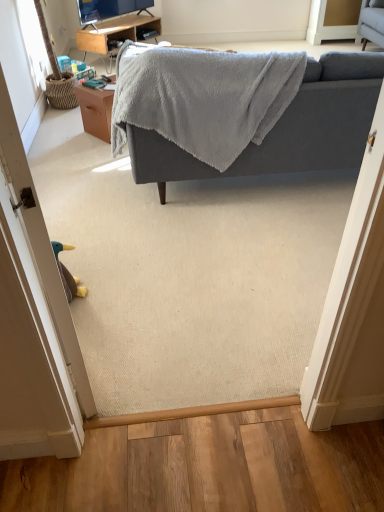
This screenshot has width=384, height=512. What do you see at coordinates (328, 26) in the screenshot? I see `white glossy screen door at upper right` at bounding box center [328, 26].

From the picture: In order to face white glossy screen door at upper right, should I rotate leftwards or rightwards?

Rotate your view right by about 19.522°.

The width and height of the screenshot is (384, 512). Describe the element at coordinates (34, 323) in the screenshot. I see `brown fabric door at lower left` at that location.

At what (x,y) coordinates should I click in order to perform the action: click on brown fabric door at lower left. Please return your answer as a coordinate pair (x, y). Looking at the image, I should click on (34, 323).

Measure the distance between gray soft fabric couch at upper center and camera.

The distance of gray soft fabric couch at upper center from camera is 2.13 meters.

Image resolution: width=384 pixels, height=512 pixels. What do you see at coordinates (96, 111) in the screenshot?
I see `brown wood table at center` at bounding box center [96, 111].

This screenshot has width=384, height=512. In order to click on white glossy screen door at upper right in this screenshot , I will do `click(328, 26)`.

Is woodendesk at upper center behind gray soft fabric couch at upper center?

Yes, it is behind gray soft fabric couch at upper center.

Is woodendesk at upper center with gray soft fabric couch at upper center?

No, woodendesk at upper center is not with gray soft fabric couch at upper center.

Does point (79, 34) appear closer or farther from the camera than point (319, 68)?

Clearly, point (79, 34) is more distant from the camera than point (319, 68).

From the image's perspective, is woodendesk at upper center positioned above or below gray soft fabric couch at upper center?

Clearly, from the image's perspective, woodendesk at upper center is above gray soft fabric couch at upper center.

Considering the positions of objects brown wood table at center and white glossy screen door at upper right in the image provided, who is behind, brown wood table at center or white glossy screen door at upper right?

white glossy screen door at upper right is further away from the camera.

From a real-world perspective, is brown wood table at center positioned above or below white glossy screen door at upper right?

Clearly, from a real-world perspective, brown wood table at center is below white glossy screen door at upper right.

From the image's perspective, would you say brown wood table at center is shown under white glossy screen door at upper right?

Yes, from the image's perspective, brown wood table at center is beneath white glossy screen door at upper right.

Where is `table that appears below the white glossy screen door at upper right (from a real-world perspective)`? This screenshot has height=512, width=384. table that appears below the white glossy screen door at upper right (from a real-world perspective) is located at coordinates (96, 111).

Which of these two, woodendesk at upper center or white glossy screen door at upper right, stands shorter?

woodendesk at upper center is shorter.

Which object is further away from the camera taking this photo, woodendesk at upper center or white glossy screen door at upper right?

white glossy screen door at upper right is behind.

In the scene shown: Is woodendesk at upper center wider or thinner than white glossy screen door at upper right?

In the image, woodendesk at upper center appears to be wider than white glossy screen door at upper right.

From a real-world perspective, relative to gray soft fabric couch at upper center, is brown wood table at center vertically above or below?

In terms of real-world spatial position, brown wood table at center is below gray soft fabric couch at upper center.

Which of these two, brown wood table at center or gray soft fabric couch at upper center, is thinner?

brown wood table at center is thinner.

Looking at this image, can we say brown wood table at center lies outside gray soft fabric couch at upper center?

brown wood table at center lies outside gray soft fabric couch at upper center's area.

From the image's perspective, would you say white glossy screen door at upper right is positioned over gray soft fabric couch at upper center?

Correct, white glossy screen door at upper right appears higher than gray soft fabric couch at upper center in the image.

Which point is more forward, (309, 28) or (140, 181)?

The point (140, 181) is in front.

Can you confirm if white glossy screen door at upper right is taller than gray soft fabric couch at upper center?

Incorrect, the height of white glossy screen door at upper right is not larger of that of gray soft fabric couch at upper center.

The width and height of the screenshot is (384, 512). Find the location of `screen door above the gray soft fabric couch at upper center (from the image's perspective)`. screen door above the gray soft fabric couch at upper center (from the image's perspective) is located at coordinates (328, 26).

Is brown fabric door at lower left not close to gray soft fabric couch at upper center?

Yes.

In the scene shown: Between brown fabric door at lower left and gray soft fabric couch at upper center, which one has larger size?

gray soft fabric couch at upper center is bigger.

Is brown fabric door at lower left completely or partially outside of gray soft fabric couch at upper center?

Yes.

Are gray soft fabric couch at upper center and white glossy screen door at upper right beside each other?

No, gray soft fabric couch at upper center is not next to white glossy screen door at upper right.

Is the depth of gray soft fabric couch at upper center greater than that of white glossy screen door at upper right?

No, gray soft fabric couch at upper center is closer to the viewer.

Can you confirm if gray soft fabric couch at upper center is positioned to the right of white glossy screen door at upper right?

Incorrect, gray soft fabric couch at upper center is not on the right side of white glossy screen door at upper right.

Which is behind, point (304, 115) or point (354, 36)?

Positioned behind is point (354, 36).

Find the location of a particular element. The image size is (384, 512). studio couch above the woodendesk at upper center (from a real-world perspective) is located at coordinates 284,129.

Where is `screen door located behind the brown wood table at center`? The height and width of the screenshot is (512, 384). screen door located behind the brown wood table at center is located at coordinates (328, 26).

Considering their positions, is woodendesk at upper center positioned further to gray soft fabric couch at upper center than brown fabric door at lower left?

woodendesk at upper center lies further to gray soft fabric couch at upper center than the other object.

Considering their positions, is white glossy screen door at upper right positioned further to gray soft fabric couch at upper center than woodendesk at upper center?

Based on the image, woodendesk at upper center appears to be further to gray soft fabric couch at upper center.

Estimate the real-world distances between objects in this image. Which object is further from woodendesk at upper center, brown fabric door at lower left or white glossy screen door at upper right?

brown fabric door at lower left is positioned further to the anchor woodendesk at upper center.

Considering their positions, is brown wood table at center positioned further to brown fabric door at lower left than woodendesk at upper center?

Among the two, woodendesk at upper center is located further to brown fabric door at lower left.

Considering their positions, is brown wood table at center positioned closer to brown fabric door at lower left than gray soft fabric couch at upper center?

Among the two, gray soft fabric couch at upper center is located nearer to brown fabric door at lower left.

Which object lies further to the anchor point woodendesk at upper center, gray soft fabric couch at upper center or white glossy screen door at upper right?

gray soft fabric couch at upper center.

Looking at the image, which one is located closer to woodendesk at upper center, gray soft fabric couch at upper center or brown fabric door at lower left?

The object closer to woodendesk at upper center is gray soft fabric couch at upper center.

Based on the photo, based on their spatial positions, is woodendesk at upper center or brown wood table at center closer to white glossy screen door at upper right?

The object closer to white glossy screen door at upper right is woodendesk at upper center.

At what (x,y) coordinates should I click in order to perform the action: click on studio couch between brown fabric door at lower left and brown wood table at center from front to back. Please return your answer as a coordinate pair (x, y). Looking at the image, I should click on (284, 129).

Locate an element on the screen. desk between brown fabric door at lower left and white glossy screen door at upper right in the front-back direction is located at coordinates (117, 34).

Identify the location of desk between gray soft fabric couch at upper center and white glossy screen door at upper right from front to back. (117, 34).

You are a GUI agent. You are given a task and a screenshot of the screen. Output one action in this format:
    pyautogui.click(x=<x>, y=<y>)
    Task: Click on the table between brown fabric door at lower left and woodendesk at upper center along the z-axis
    This screenshot has height=512, width=384.
    Given the screenshot: What is the action you would take?
    pyautogui.click(x=96, y=111)